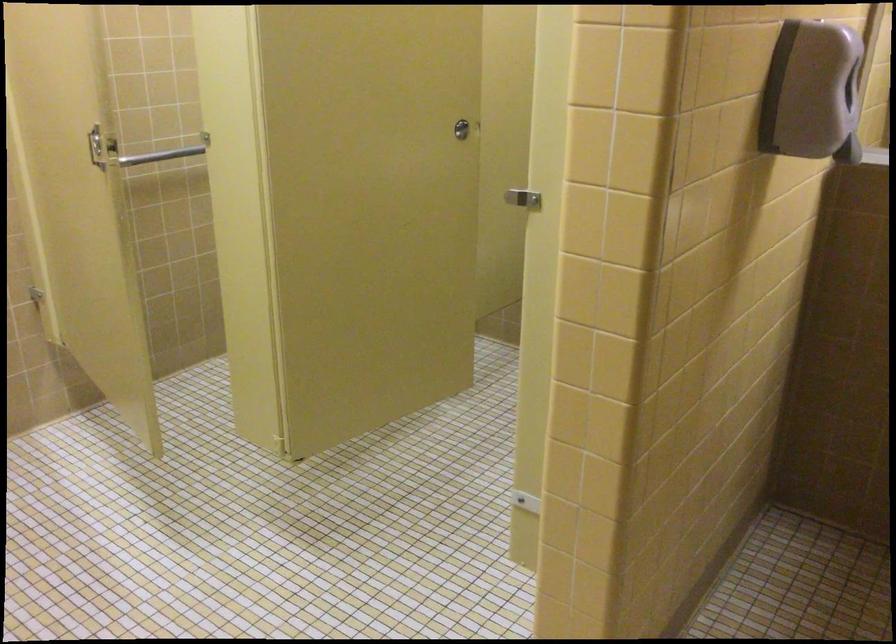
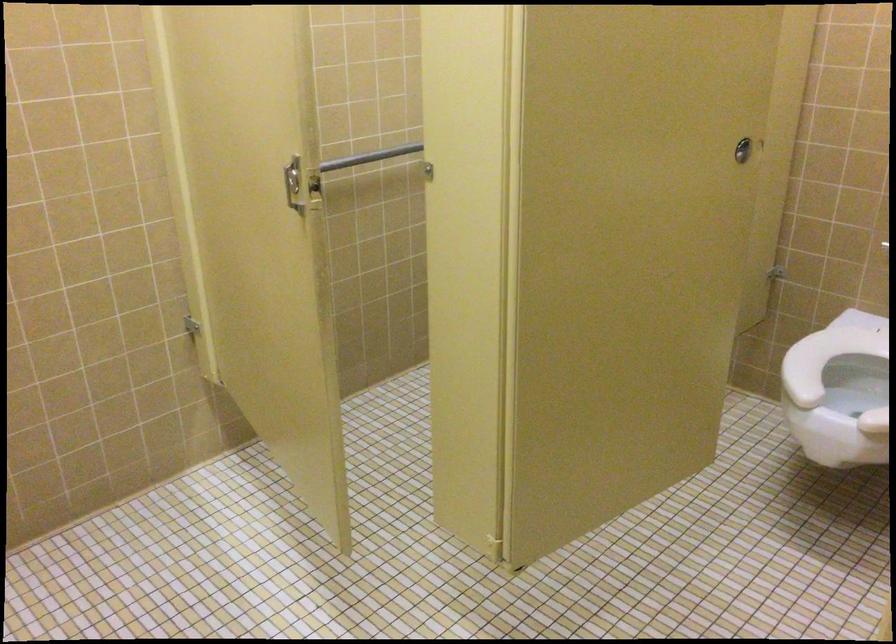
Locate, in the second image, the point that corresponds to point (463, 134) in the first image.

(743, 149)